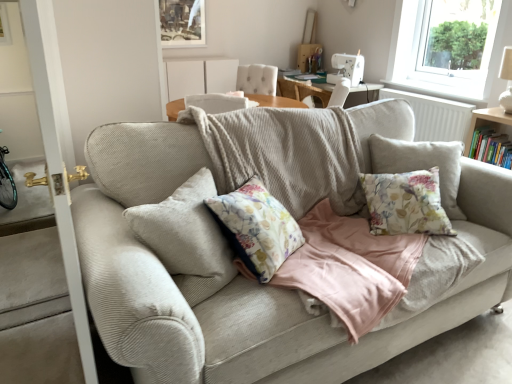
Question: Is transparent glass window at upper right turned away from matte wooden picture frame at upper center?

Choices:
 (A) no
 (B) yes

Answer: (A)

Question: Does transparent glass window at upper right have a larger size compared to matte wooden picture frame at upper center?

Choices:
 (A) no
 (B) yes

Answer: (B)

Question: Is transparent glass window at upper right outside matte wooden picture frame at upper center?

Choices:
 (A) yes
 (B) no

Answer: (A)

Question: From the image's perspective, is transparent glass window at upper right beneath matte wooden picture frame at upper center?

Choices:
 (A) yes
 (B) no

Answer: (A)

Question: From the image's perspective, is transparent glass window at upper right above matte wooden picture frame at upper center?

Choices:
 (A) no
 (B) yes

Answer: (A)

Question: Looking at their shapes, would you say transparent glass window at upper right is wider or thinner than white tufted armchair at upper center?

Choices:
 (A) thin
 (B) wide

Answer: (A)

Question: From the image's perspective, is transparent glass window at upper right located above or below white tufted armchair at upper center?

Choices:
 (A) below
 (B) above

Answer: (B)

Question: Would you say transparent glass window at upper right is to the left or to the right of white tufted armchair at upper center in the picture?

Choices:
 (A) right
 (B) left

Answer: (A)

Question: Choose the correct answer: Is transparent glass window at upper right inside white tufted armchair at upper center or outside it?

Choices:
 (A) inside
 (B) outside

Answer: (B)

Question: From a real-world perspective, is matte wooden picture frame at upper center above or below white textured radiator at upper right?

Choices:
 (A) below
 (B) above

Answer: (B)

Question: Is matte wooden picture frame at upper center situated inside white textured radiator at upper right or outside?

Choices:
 (A) outside
 (B) inside

Answer: (A)

Question: From the image's perspective, is matte wooden picture frame at upper center located above or below white textured radiator at upper right?

Choices:
 (A) below
 (B) above

Answer: (B)

Question: Looking at their shapes, would you say matte wooden picture frame at upper center is wider or thinner than white textured radiator at upper right?

Choices:
 (A) wide
 (B) thin

Answer: (B)

Question: From the image's perspective, is hardcover book at right above or below white tufted armchair at upper center?

Choices:
 (A) above
 (B) below

Answer: (B)

Question: Is point (501, 135) positioned closer to the camera than point (259, 84)?

Choices:
 (A) farther
 (B) closer

Answer: (B)